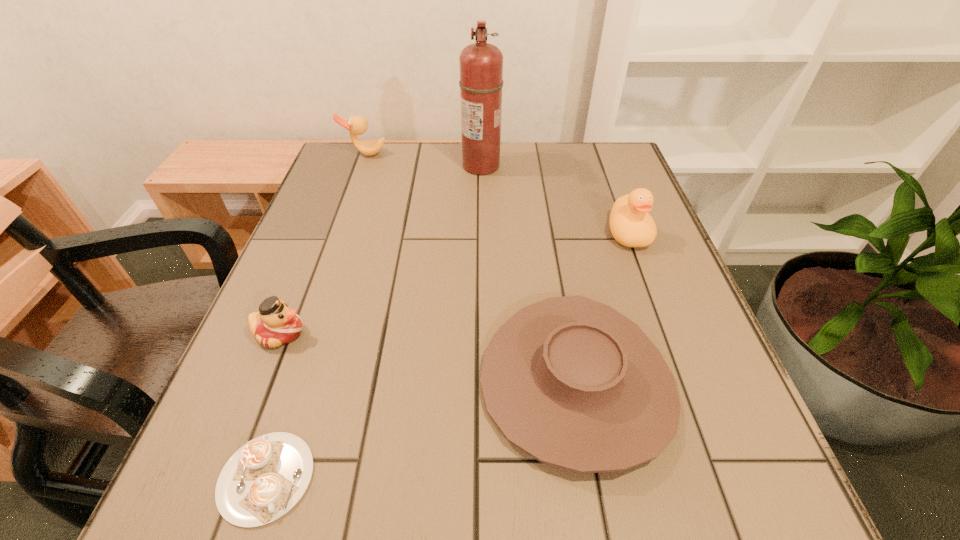
Image resolution: width=960 pixels, height=540 pixels. Identify the location of free space located 0.230m on the face of the rightmost duck. (667, 338).

Where is `vacant space located 0.270m on the beak of the farthest duck`? vacant space located 0.270m on the beak of the farthest duck is located at coordinates (342, 218).

At what (x,y) coordinates should I click in order to perform the action: click on blank area located 0.250m on the face of the nearest duck. Please return your answer as a coordinate pair (x, y). Looking at the image, I should click on (442, 333).

The height and width of the screenshot is (540, 960). I want to click on free space located 0.120m on the left of the cowboy hat, so click(x=408, y=383).

Find the location of `vacant region located on the back of the shortest object`. vacant region located on the back of the shortest object is located at coordinates (291, 404).

Find the location of a particular element. The width and height of the screenshot is (960, 540). fire extinguisher that is at the far edge is located at coordinates (481, 64).

Locate an element on the screen. The image size is (960, 540). duck located in the far edge section of the desktop is located at coordinates (357, 125).

Find the location of `cowboy hat located at the near edge`. cowboy hat located at the near edge is located at coordinates (572, 382).

Find the location of a particular element. The width and height of the screenshot is (960, 540). cappuccino at the near edge is located at coordinates (266, 477).

This screenshot has width=960, height=540. Identify the location of cappuccino that is at the left edge. (266, 477).